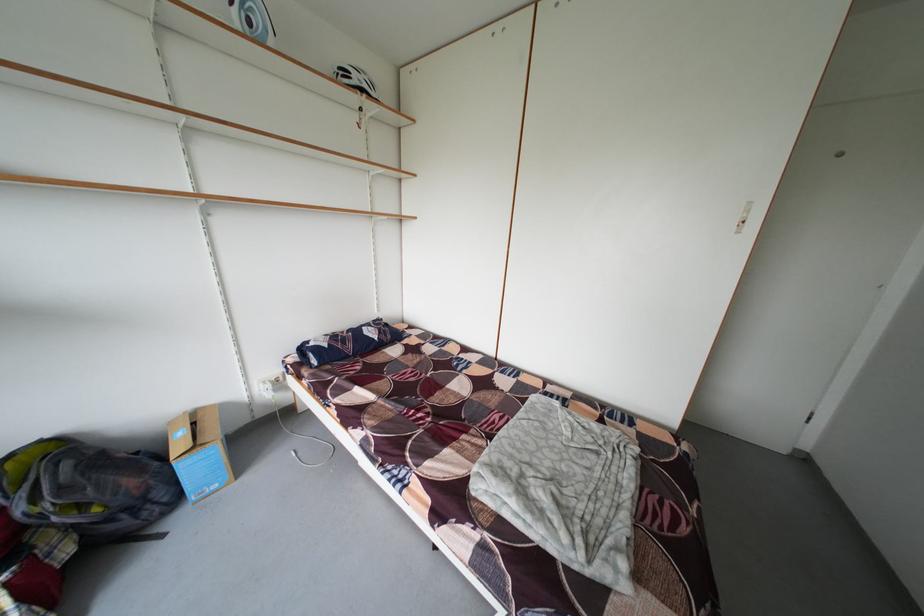
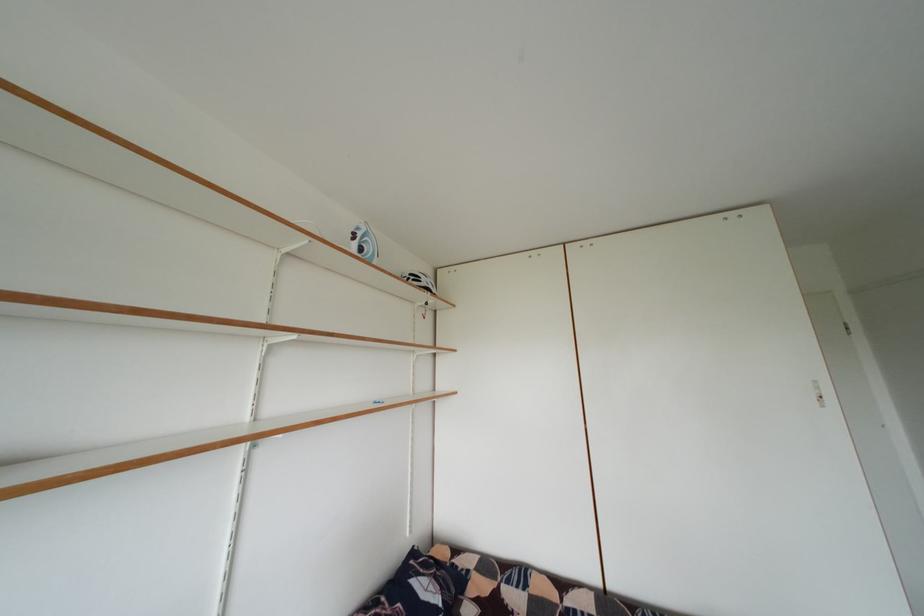
The first image is from the beginning of the video and the second image is from the end. How did the camera likely rotate when shooting the video?

The camera's rotation is toward right-up.